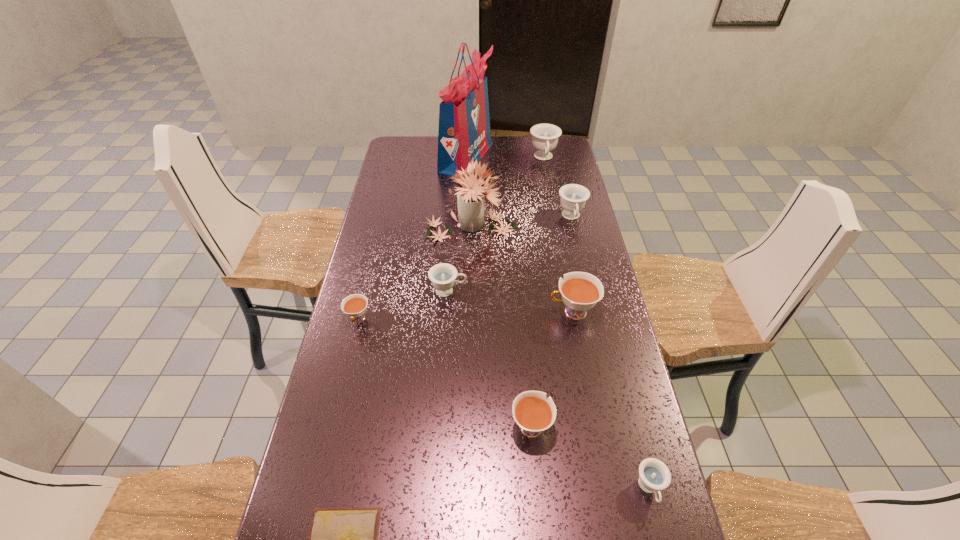
Locate an element on the screen. vacant space situated on the side of the biggest white teacup with the handle is located at coordinates (516, 312).

Identify the location of vacant area situated 0.130m on the side of the biggest white teacup with the handle. (x=507, y=312).

Locate an element on the screen. vacant area situated 0.200m on the side of the biggest white teacup with the handle is located at coordinates (484, 312).

Where is `vacant space located on the side of the third smallest blue teacup with the handle`? Image resolution: width=960 pixels, height=540 pixels. vacant space located on the side of the third smallest blue teacup with the handle is located at coordinates (593, 313).

Where is `vacant area situated 0.290m on the side of the third teacup from left to right with the handle`? vacant area situated 0.290m on the side of the third teacup from left to right with the handle is located at coordinates (522, 316).

I want to click on free space located on the side of the third teacup from left to right with the handle, so click(x=524, y=349).

Identify the location of vacant point located 0.250m on the side of the third teacup from left to right with the handle. The height and width of the screenshot is (540, 960). (522, 327).

Locate an element on the screen. Image resolution: width=960 pixels, height=540 pixels. free space located 0.100m on the side of the third biggest blue teacup with the handle is located at coordinates (498, 291).

What are the coordinates of `vacant space located 0.100m on the side of the leftmost white teacup with the handle` in the screenshot? It's located at (348, 360).

What are the coordinates of `grocery bag that is at the far edge` in the screenshot? It's located at (464, 135).